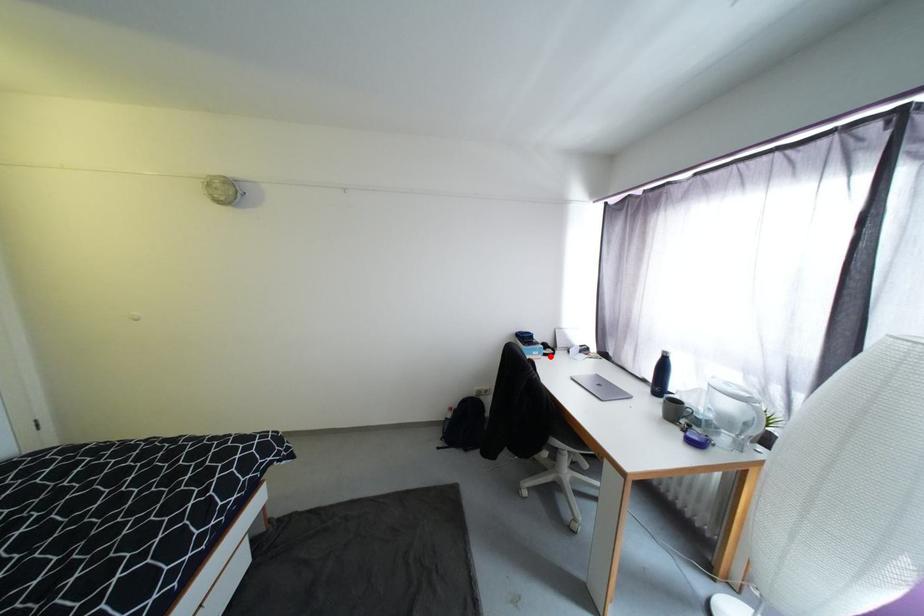
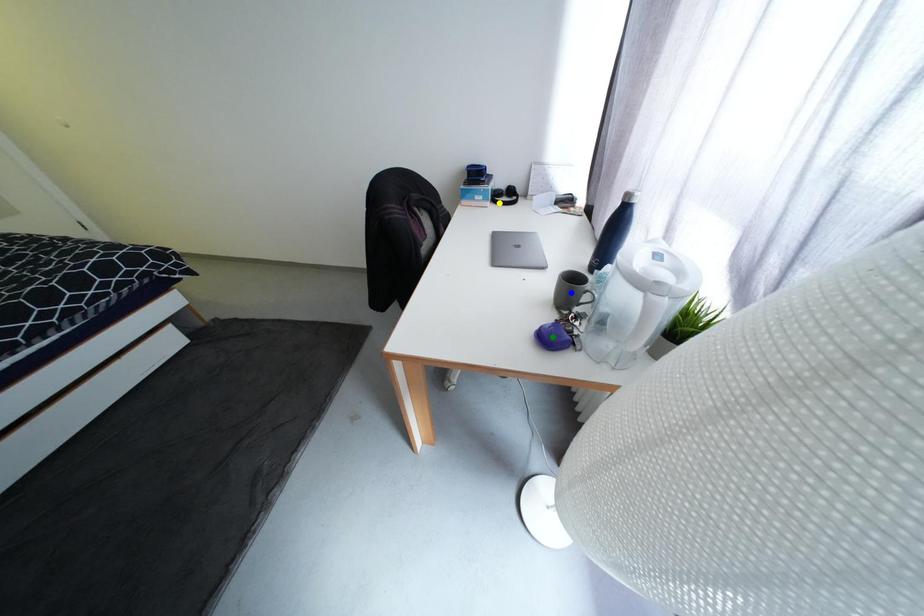
Question: I am providing you with two images of the same scene from different viewpoints. A red point is marked on the first image. You are given multiple points on the second image. Which point in image 2 is actually the same real-world point as the red point in image 1?

Choices:
 (A) blue point
 (B) green point
 (C) yellow point

Answer: (C)